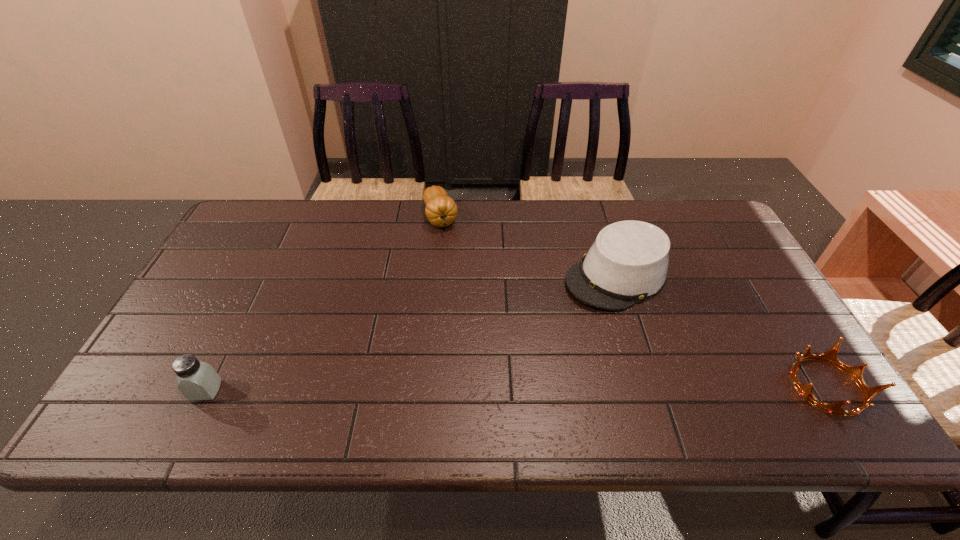
This screenshot has width=960, height=540. In order to click on object that is at the right edge in this screenshot , I will do `click(855, 372)`.

The height and width of the screenshot is (540, 960). In order to click on object present at the near left corner in this screenshot , I will do `click(197, 380)`.

Identify the location of object that is positioned at the near right corner. Image resolution: width=960 pixels, height=540 pixels. (855, 372).

Locate an element on the screen. Image resolution: width=960 pixels, height=540 pixels. free space at the far edge of the desktop is located at coordinates (623, 211).

Where is `vacant position at the near edge of the desktop`? vacant position at the near edge of the desktop is located at coordinates (266, 364).

I want to click on vacant region at the left edge of the desktop, so click(204, 298).

This screenshot has height=540, width=960. Find the location of `blank space at the right edge of the desktop`. blank space at the right edge of the desktop is located at coordinates (753, 346).

The width and height of the screenshot is (960, 540). In order to click on free space at the far left corner of the desktop in this screenshot , I will do `click(282, 208)`.

Where is `free space between the crown and the saltshaker`? The image size is (960, 540). free space between the crown and the saltshaker is located at coordinates (516, 388).

Identify the location of free point between the leftmost object and the crown. 516,388.